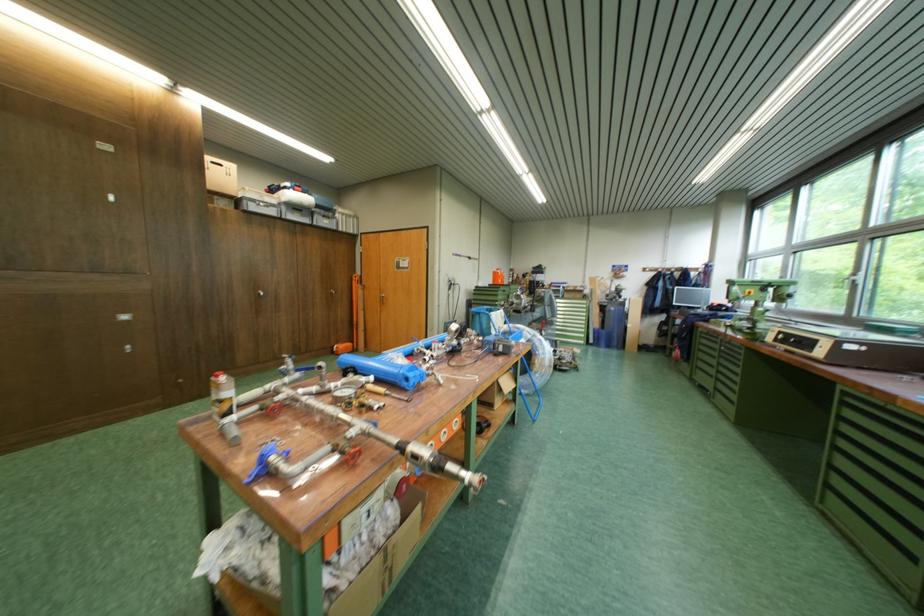
Identify the location of orange level tool. (355, 318).